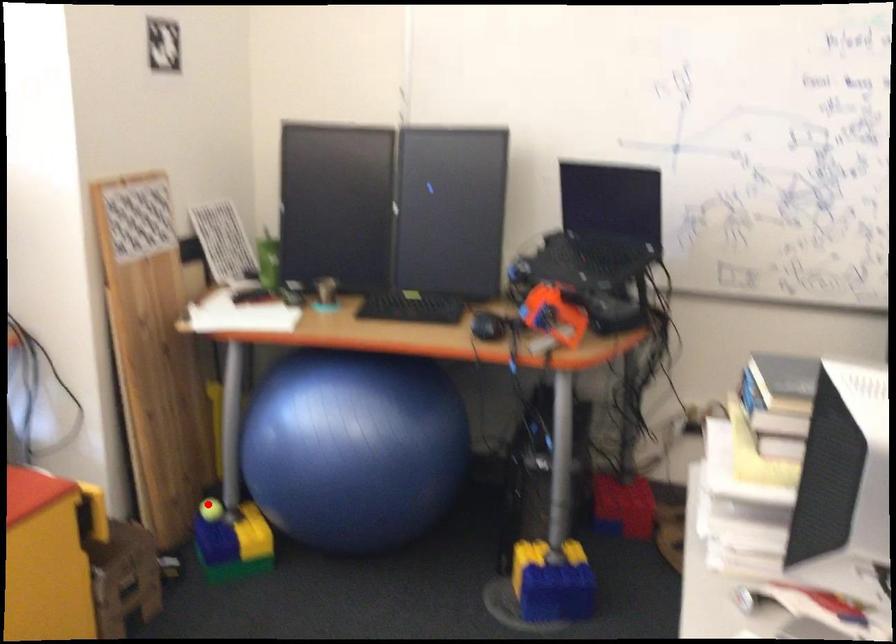
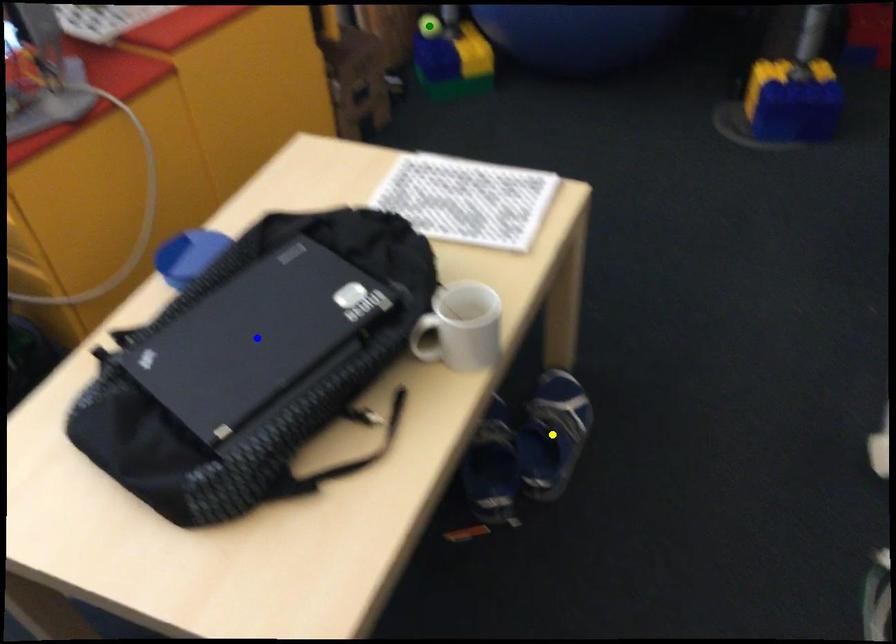
Question: I am providing you with two images of the same scene from different viewpoints. A red point is marked on the first image. You are given multiple points on the second image. Which spot in image 2 lines up with the point in image 1?

Choices:
 (A) green point
 (B) blue point
 (C) yellow point

Answer: (A)